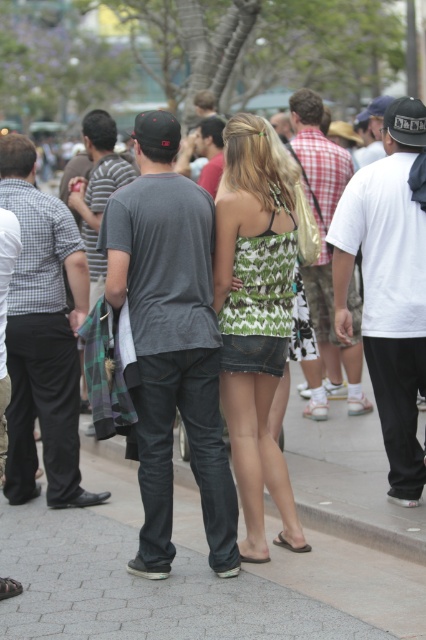
In the scene shown: Can you confirm if white cotton t-shirt at right is thinner than white cotton shirt at center?

Indeed, white cotton t-shirt at right has a lesser width compared to white cotton shirt at center.

Is white cotton t-shirt at right smaller than white cotton shirt at center?

Yes.

Where is `white cotton t-shirt at right`? The image size is (426, 640). white cotton t-shirt at right is located at coordinates (388, 289).

Identify the location of white cotton t-shirt at right. (388, 289).

Who is positioned more to the left, dark gray cotton t-shirt at center or white cotton t-shirt at right?

Positioned to the left is dark gray cotton t-shirt at center.

Based on the photo, can you confirm if dark gray cotton t-shirt at center is taller than white cotton t-shirt at right?

Yes, dark gray cotton t-shirt at center is taller than white cotton t-shirt at right.

I want to click on dark gray cotton t-shirt at center, so click(x=170, y=340).

Does dark gray cotton t-shirt at center have a lesser width compared to dark gray t-shirt at center?

In fact, dark gray cotton t-shirt at center might be wider than dark gray t-shirt at center.

Is dark gray cotton t-shirt at center bigger than dark gray t-shirt at center?

Actually, dark gray cotton t-shirt at center might be smaller than dark gray t-shirt at center.

Who is more forward, (180,326) or (103,145)?

Point (180,326)

Where is `dark gray cotton t-shirt at center`? This screenshot has width=426, height=640. dark gray cotton t-shirt at center is located at coordinates (170, 340).